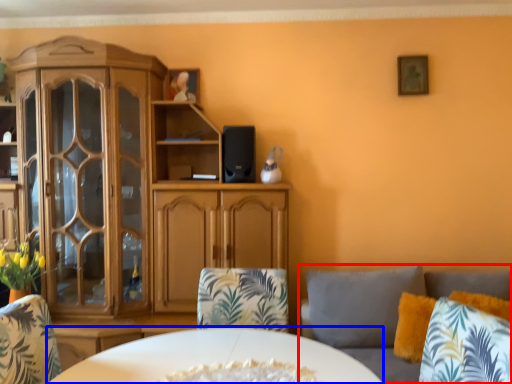
Question: Which object is closer to the camera taking this photo, studio couch (highlighted by a red box) or desk (highlighted by a blue box)?

Choices:
 (A) studio couch
 (B) desk

Answer: (A)